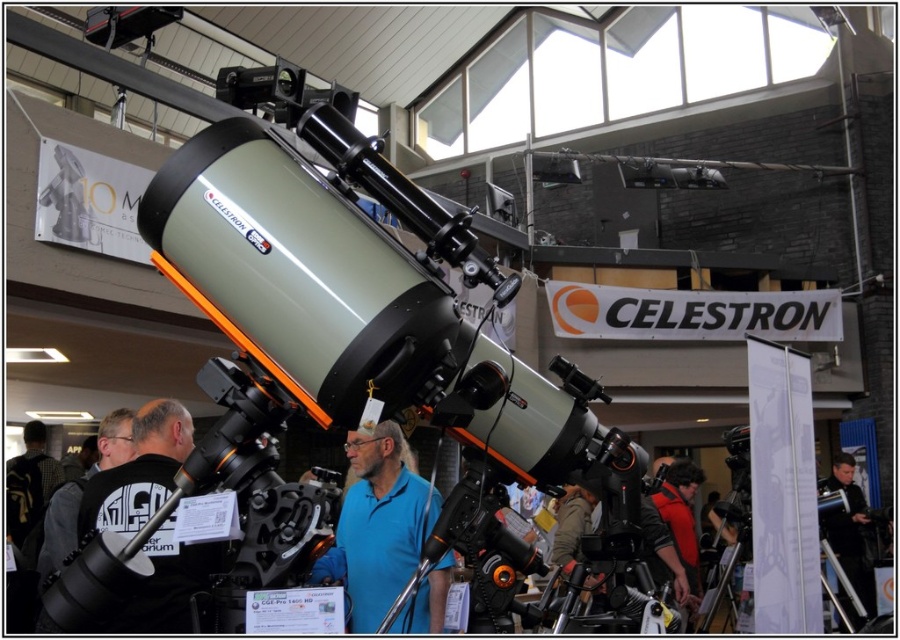
You are attending an exhibition and notice two attendees wearing black fabric shirt at center and black matte jacket at center. Which one is positioned to the left?

The black fabric shirt at center is positioned to the left of the black matte jacket at center.

You are at a trade show and see two shirts displayed at the center of the image. The blue matte shirt at center and the black fabric shirt at center. Which one is positioned to the right?

The blue matte shirt at center is positioned to the right of the black fabric shirt at center.

You are attending an astronomy exhibition and notice two attendees wearing a blue matte shirt at center and a black matte jacket at center. From your perspective at the entrance, which clothing item is located to the left?

The blue matte shirt at center is positioned on the left side of the black matte jacket at center, so from your perspective at the entrance, the blue matte shirt at center is to the left.